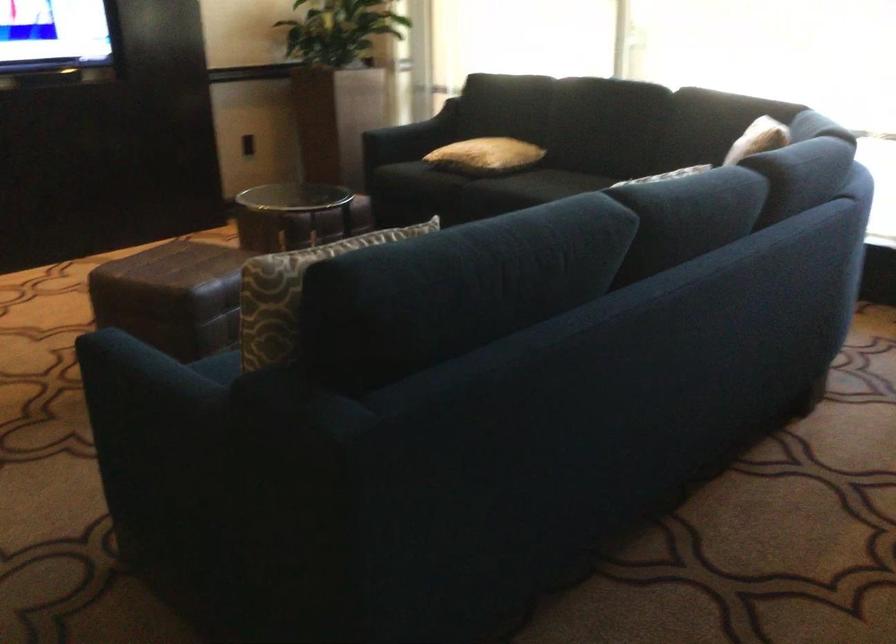
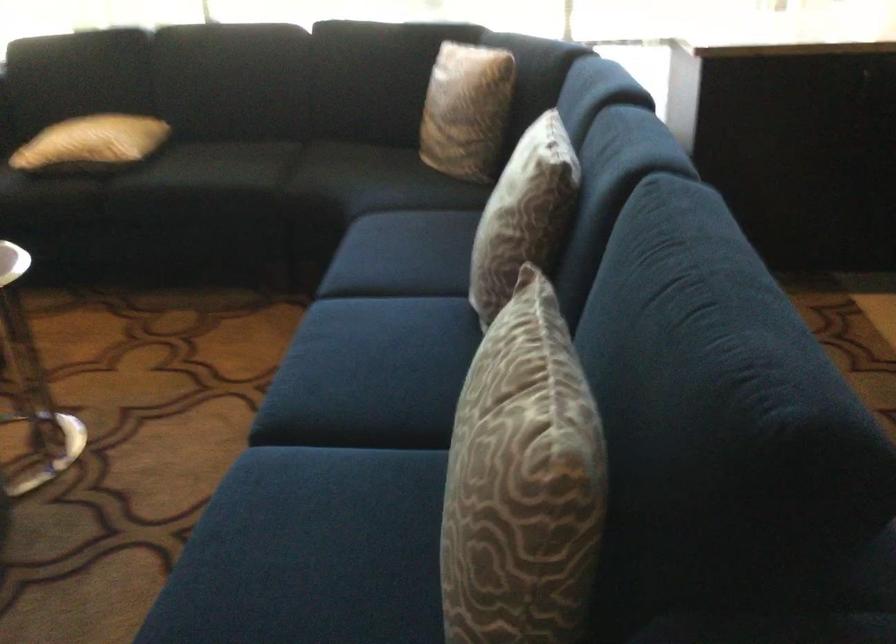
Find the pixel in the second image that matches point 509,99 in the first image.

(82, 64)